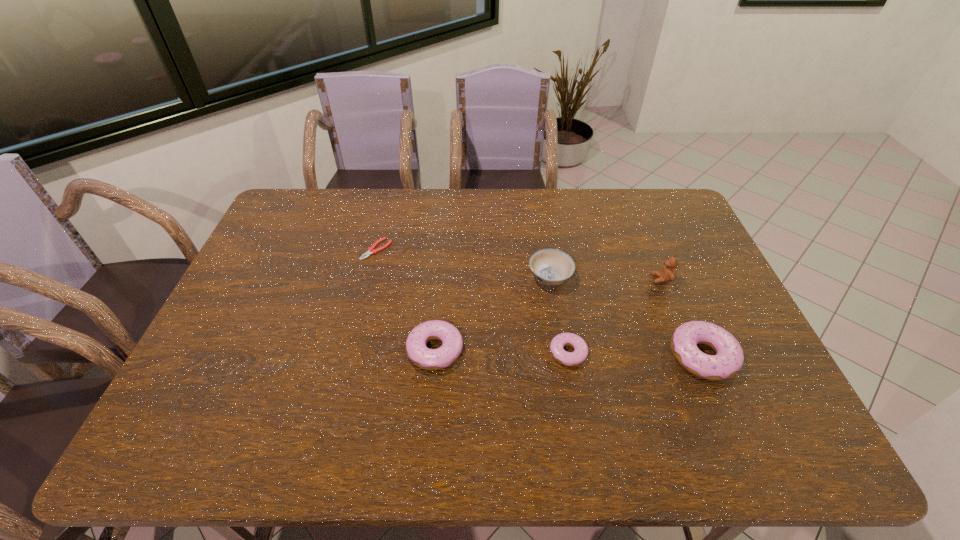
Locate an element on the screen. This screenshot has height=540, width=960. the leftmost doughnut is located at coordinates (429, 359).

At what (x,y) coordinates should I click in order to perform the action: click on the second shortest doughnut. Please return your answer as a coordinate pair (x, y). The width and height of the screenshot is (960, 540). Looking at the image, I should click on (429, 359).

Identify the location of the fifth tallest object. The height and width of the screenshot is (540, 960). (557, 345).

What are the coordinates of `the second doughnut from right to left` in the screenshot? It's located at (557, 345).

The width and height of the screenshot is (960, 540). In order to click on the rightmost doughnut in this screenshot , I will do `click(729, 358)`.

Where is `bowl`? The height and width of the screenshot is (540, 960). bowl is located at coordinates (549, 266).

This screenshot has height=540, width=960. I want to click on the leftmost object, so click(x=371, y=250).

At what (x,y) coordinates should I click in order to perform the action: click on the farthest object. Please return your answer as a coordinate pair (x, y). Looking at the image, I should click on (371, 250).

Where is `the tallest object`? the tallest object is located at coordinates tap(667, 274).

This screenshot has height=540, width=960. I want to click on free space located on the right of the second shortest doughnut, so click(x=558, y=349).